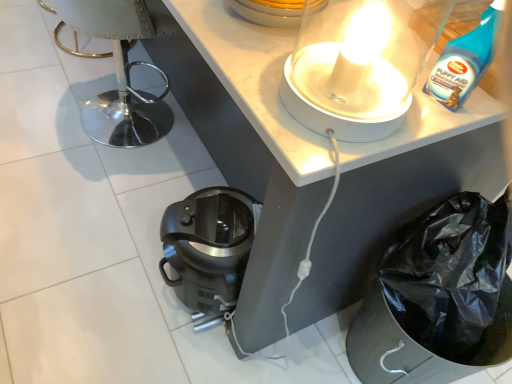
The image size is (512, 384). Describe the element at coordinates (358, 66) in the screenshot. I see `white glossy lamp at upper center` at that location.

The height and width of the screenshot is (384, 512). What do you see at coordinates (209, 250) in the screenshot?
I see `black plastic coffee maker at lower center` at bounding box center [209, 250].

Where is `blue plastic bottle at upper right`? The width and height of the screenshot is (512, 384). blue plastic bottle at upper right is located at coordinates (464, 55).

Is blue plastic bottle at upper right taller or shorter than metallic silver swivel chair at left?

Clearly, blue plastic bottle at upper right is shorter compared to metallic silver swivel chair at left.

Who is more distant, blue plastic bottle at upper right or metallic silver swivel chair at left?

metallic silver swivel chair at left is further from the camera.

Do you think blue plastic bottle at upper right is within metallic silver swivel chair at left, or outside of it?

The correct answer is: outside.

Identify the location of cleaning product lying below the metallic silver swivel chair at left (from the image's perspective). This screenshot has height=384, width=512. (464, 55).

What's the angular difference between white glossy lamp at upper center and black plastic coffee maker at lower center's facing directions?

179 degrees.

Could you tell me if white glossy lamp at upper center is turned towards black plastic coffee maker at lower center?

No, white glossy lamp at upper center is not turned towards black plastic coffee maker at lower center.

Identify the location of home appliance located underneath the white glossy lamp at upper center (from a real-world perspective). (209, 250).

From the picture: Measure the distance from white glossy lamp at upper center to black plastic coffee maker at lower center.

white glossy lamp at upper center and black plastic coffee maker at lower center are 60.36 centimeters apart.

At what (x,y) coordinates should I click in order to perform the action: click on kitchen appliance on the right of matte black coffee maker at lower center. Please return your answer as a coordinate pair (x, y). The width and height of the screenshot is (512, 384). Looking at the image, I should click on (358, 66).

Can you confirm if matte black coffee maker at lower center is wider than white glossy lamp at upper center?

Indeed, matte black coffee maker at lower center has a greater width compared to white glossy lamp at upper center.

Is matte black coffee maker at lower center aimed at white glossy lamp at upper center?

No, matte black coffee maker at lower center is not oriented towards white glossy lamp at upper center.

Can you tell me how much matte black coffee maker at lower center and white glossy lamp at upper center differ in facing direction?

The facing directions of matte black coffee maker at lower center and white glossy lamp at upper center are 0.378 degrees apart.

From the image's perspective, which one is positioned lower, metallic silver swivel chair at left or black plastic coffee maker at lower center?

black plastic coffee maker at lower center appears lower in the image.

In the scene shown: Is metallic silver swivel chair at left placed right next to black plastic coffee maker at lower center?

metallic silver swivel chair at left and black plastic coffee maker at lower center are clearly separated.

In the image, is metallic silver swivel chair at left positioned in front of or behind black plastic coffee maker at lower center?

metallic silver swivel chair at left is behind black plastic coffee maker at lower center.

Can you confirm if metallic silver swivel chair at left is bigger than black plastic coffee maker at lower center?

Yes.

Which is correct: matte black coffee maker at lower center is inside blue plastic bottle at upper right, or outside of it?

matte black coffee maker at lower center cannot be found inside blue plastic bottle at upper right.

Would you consider matte black coffee maker at lower center to be distant from blue plastic bottle at upper right?

matte black coffee maker at lower center is near blue plastic bottle at upper right, not far away.

From a real-world perspective, who is located higher, matte black coffee maker at lower center or blue plastic bottle at upper right?

In real-world perspective, blue plastic bottle at upper right is above.

Is blue plastic bottle at upper right at the back of matte black coffee maker at lower center?

matte black coffee maker at lower center does not have its back to blue plastic bottle at upper right.

Does black plastic coffee maker at lower center have a greater height compared to matte black coffee maker at lower center?

Yes, black plastic coffee maker at lower center is taller than matte black coffee maker at lower center.

Who is smaller, black plastic coffee maker at lower center or matte black coffee maker at lower center?

With smaller size is black plastic coffee maker at lower center.

From the image's perspective, is black plastic coffee maker at lower center below matte black coffee maker at lower center?

Indeed, from the image's perspective, black plastic coffee maker at lower center is shown beneath matte black coffee maker at lower center.

From the picture: How far apart are black plastic coffee maker at lower center and matte black coffee maker at lower center?

black plastic coffee maker at lower center is 23.12 centimeters from matte black coffee maker at lower center.

Between matte black coffee maker at lower center and metallic silver swivel chair at left, which one is positioned behind?

metallic silver swivel chair at left is more distant.

Is metallic silver swivel chair at left at the back of matte black coffee maker at lower center?

matte black coffee maker at lower center is not turned away from metallic silver swivel chair at left.

Between matte black coffee maker at lower center and metallic silver swivel chair at left, which one has smaller size?

metallic silver swivel chair at left is smaller.

Identify the location of cleaning product lying on the right of metallic silver swivel chair at left. This screenshot has height=384, width=512. (464, 55).

You are a GUI agent. You are given a task and a screenshot of the screen. Output one action in this format:
    pyautogui.click(x=<x>, y=<y>)
    Task: Click on the kitchen appliance above the black plastic coffee maker at lower center (from the image's perspective)
    
    Given the screenshot: What is the action you would take?
    pyautogui.click(x=358, y=66)

When comparing their distances from black plastic coffee maker at lower center, does metallic silver swivel chair at left or white glossy lamp at upper center seem closer?

white glossy lamp at upper center is closer to black plastic coffee maker at lower center.

When comparing their distances from matte black coffee maker at lower center, does metallic silver swivel chair at left or white glossy lamp at upper center seem further?

metallic silver swivel chair at left.

Estimate the real-world distances between objects in this image. Which object is further from metallic silver swivel chair at left, black plastic coffee maker at lower center or blue plastic bottle at upper right?

blue plastic bottle at upper right lies further to metallic silver swivel chair at left than the other object.

Which object lies further to the anchor point matte black coffee maker at lower center, white glossy lamp at upper center or metallic silver swivel chair at left?

The object further to matte black coffee maker at lower center is metallic silver swivel chair at left.

Considering their positions, is matte black coffee maker at lower center positioned further to black plastic coffee maker at lower center than metallic silver swivel chair at left?

Among the two, metallic silver swivel chair at left is located further to black plastic coffee maker at lower center.

Which object lies further to the anchor point black plastic coffee maker at lower center, white glossy lamp at upper center or matte black coffee maker at lower center?

Based on the image, white glossy lamp at upper center appears to be further to black plastic coffee maker at lower center.

When comparing their distances from metallic silver swivel chair at left, does blue plastic bottle at upper right or white glossy lamp at upper center seem further?

The object further to metallic silver swivel chair at left is blue plastic bottle at upper right.

When comparing their distances from metallic silver swivel chair at left, does black plastic coffee maker at lower center or white glossy lamp at upper center seem further?

The object further to metallic silver swivel chair at left is white glossy lamp at upper center.

Locate an element on the screen. The height and width of the screenshot is (384, 512). home appliance between metallic silver swivel chair at left and blue plastic bottle at upper right from left to right is located at coordinates (209, 250).

Find the location of a particular element. The width and height of the screenshot is (512, 384). cleaning product between matte black coffee maker at lower center and black plastic coffee maker at lower center vertically is located at coordinates (464, 55).

You are a GUI agent. You are given a task and a screenshot of the screen. Output one action in this format:
    pyautogui.click(x=<x>, y=<y>)
    Task: Click on the kitchen appliance between matte black coffee maker at lower center and black plastic coffee maker at lower center in the vertical direction
    This screenshot has height=384, width=512.
    Given the screenshot: What is the action you would take?
    coord(358,66)

Where is `vanity between metallic silver swivel chair at left and blue plastic bottle at upper right from left to right`? This screenshot has height=384, width=512. vanity between metallic silver swivel chair at left and blue plastic bottle at upper right from left to right is located at coordinates (248, 144).